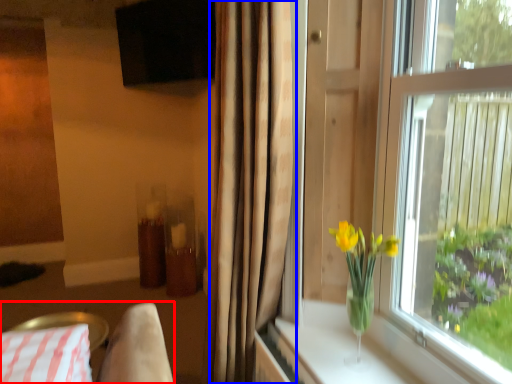
Question: Which point is closer to the camera, bedding (highlighted by a red box) or curtain (highlighted by a blue box)?

Choices:
 (A) bedding
 (B) curtain

Answer: (B)